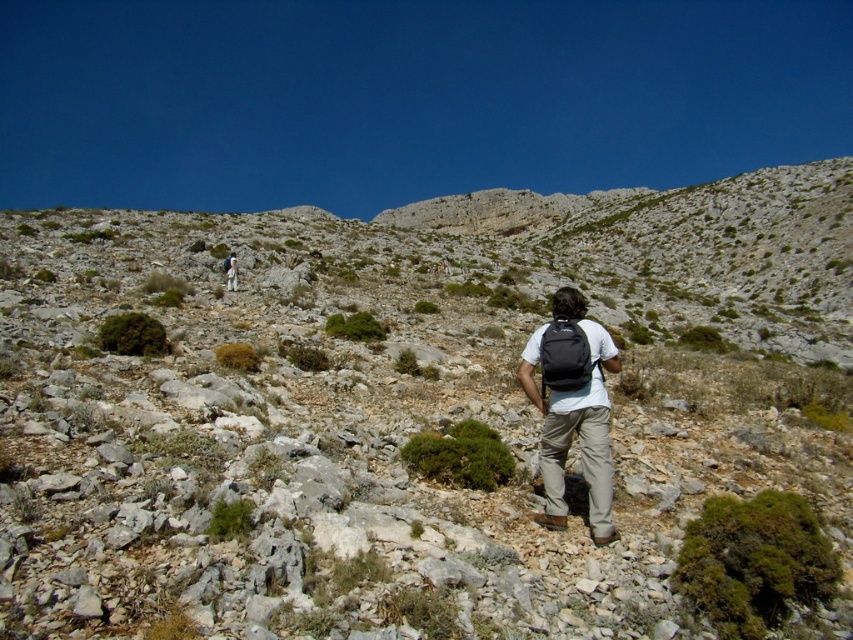
Question: Does green leafy bush at lower left appear over matte gray backpack at center?

Choices:
 (A) no
 (B) yes

Answer: (A)

Question: Considering the relative positions of green shrub at center and green leafy bush at lower left in the image provided, where is green shrub at center located with respect to green leafy bush at lower left?

Choices:
 (A) left
 (B) right

Answer: (B)

Question: Which point is farther to the camera?

Choices:
 (A) (233, 282)
 (B) (447, 429)
 (C) (115, 349)
 (D) (337, 321)

Answer: (A)

Question: Which of these objects is positioned closest to the green mossy bush at lower right?

Choices:
 (A) green mossy shrub at center
 (B) matte gray backpack at center

Answer: (A)

Question: Among these points, which one is farthest from the camera?

Choices:
 (A) (480, 432)
 (B) (325, 328)
 (C) (680, 547)

Answer: (B)

Question: From the image, what is the correct spatial relationship of matte black backpack at center in relation to green mossy shrub at center?

Choices:
 (A) right
 (B) left

Answer: (A)